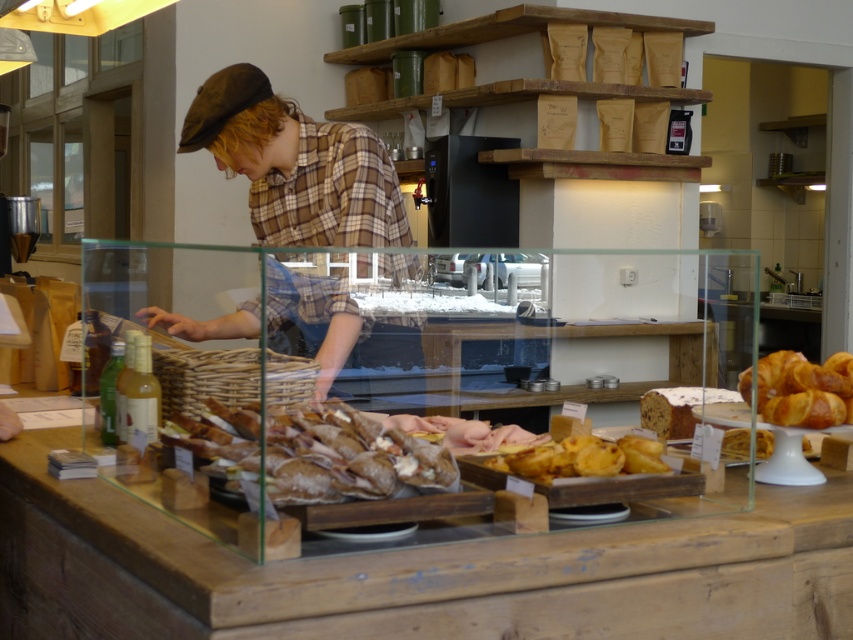
You are a customer at the bakery counter and want to order the slightly toasted bread at center and the golden flaky croissant at upper right. Which item is located to the left of the other?

The slightly toasted bread at center is positioned on the left side of golden flaky croissant at upper right, so the slightly toasted bread at center is to the left of the golden flaky croissant at upper right.

You are a customer at the bakery and want to point out the golden flaky croissant at upper right. Which pastry is located above the golden brown pastry at center?

The golden flaky croissant at upper right is positioned over golden brown pastry at center.